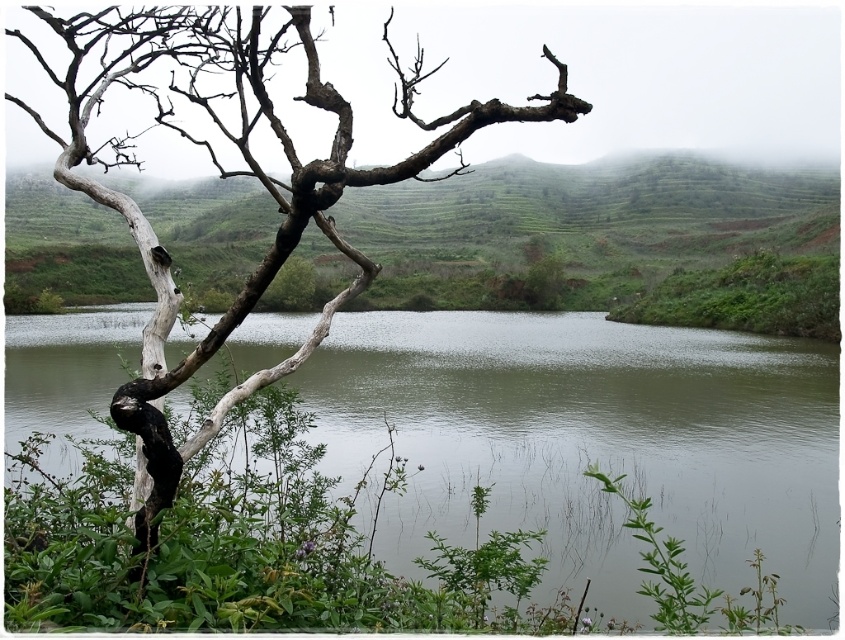
Is green smooth water at center wider than green grassy hillside at upper center?

In fact, green smooth water at center might be narrower than green grassy hillside at upper center.

Can you confirm if green smooth water at center is positioned below green grassy hillside at upper center?

Yes.

Is point (298, 326) farther from camera compared to point (236, 289)?

No, (298, 326) is in front of (236, 289).

Where is `green smooth water at center`? green smooth water at center is located at coordinates (593, 442).

Does point (548, 436) come behind point (311, 81)?

That is True.

Which is above, green smooth water at center or white rough branch at left?

Positioned higher is white rough branch at left.

The height and width of the screenshot is (640, 845). What do you see at coordinates (593, 442) in the screenshot?
I see `green smooth water at center` at bounding box center [593, 442].

Locate an element on the screen. green smooth water at center is located at coordinates (593, 442).

Is green grassy hillside at upper center smaller than white rough branch at left?

Actually, green grassy hillside at upper center might be larger than white rough branch at left.

Where is `green grassy hillside at upper center`? green grassy hillside at upper center is located at coordinates (611, 243).

You are a GUI agent. You are given a task and a screenshot of the screen. Output one action in this format:
    pyautogui.click(x=<x>, y=<y>)
    Task: Click on the green grassy hillside at upper center
    
    Given the screenshot: What is the action you would take?
    pyautogui.click(x=611, y=243)

Identify the location of green grassy hillside at upper center. This screenshot has height=640, width=845. (611, 243).